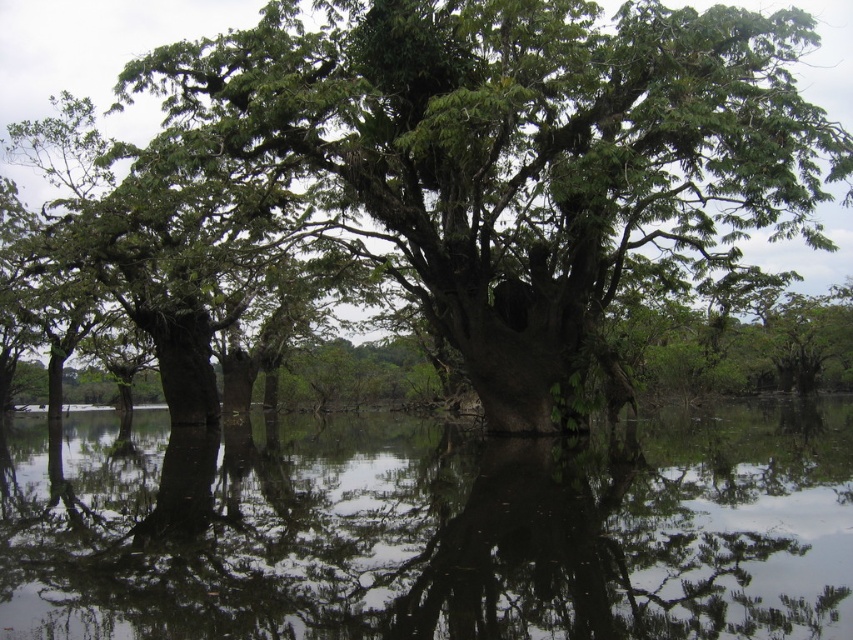
You are standing at the edge of the water and see the clear water at center and the green rough bark tree at center. Which object is positioned to the right of the other?

The clear water at center is to the right of the green rough bark tree at center.

Based on the scene description, which object is shorter, the clear water at center or the green rough bark tree at center?

The clear water at center is shorter than the green rough bark tree at center according to the description.

You are a kayaker planning to paddle through the area shown in the image. You need to know if your kayak can pass between the clear water at center and the green rough bark tree at center. The kayak is 1.2 meters wide. Can you fit through the space between them?

The clear water at center is thinner than the green rough bark tree at center. Since the clear water is thinner, the space between them may be narrower than the tree itself. However, without specific measurements, it is uncertain if the 1.2 meter wide kayak can pass safely. It is recommended to check the actual width of the space before proceeding.